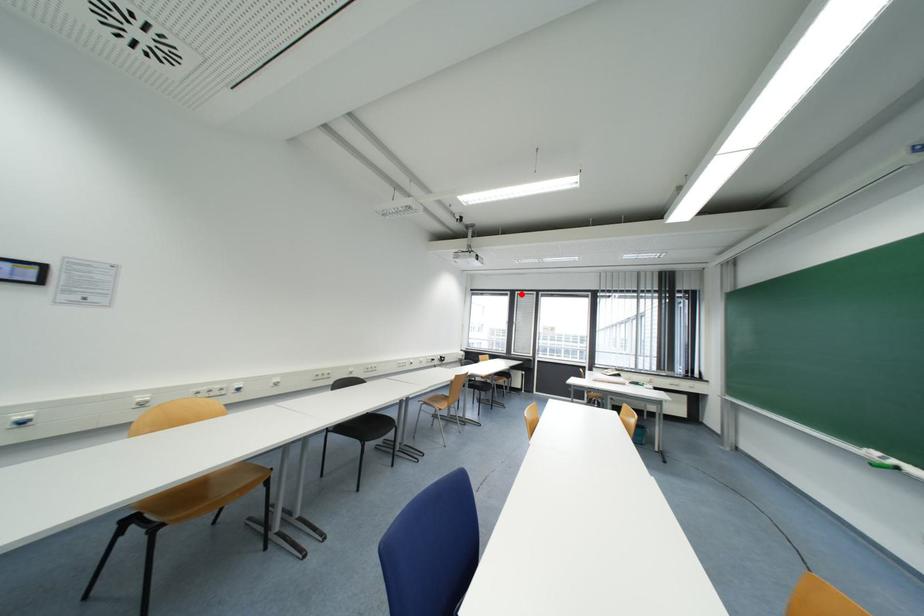
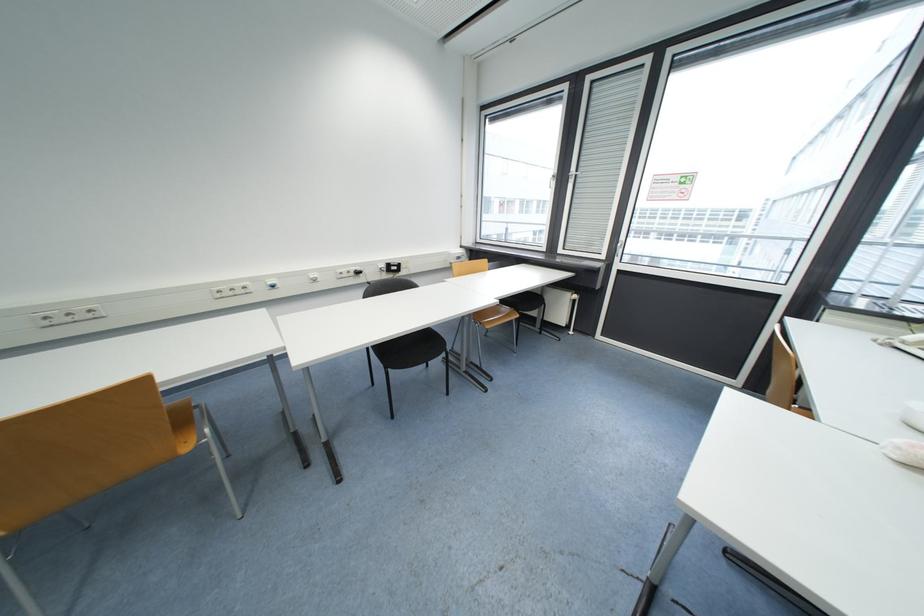
In the second image, find the point that corresponds to the highlighted location in the first image.

(593, 81)